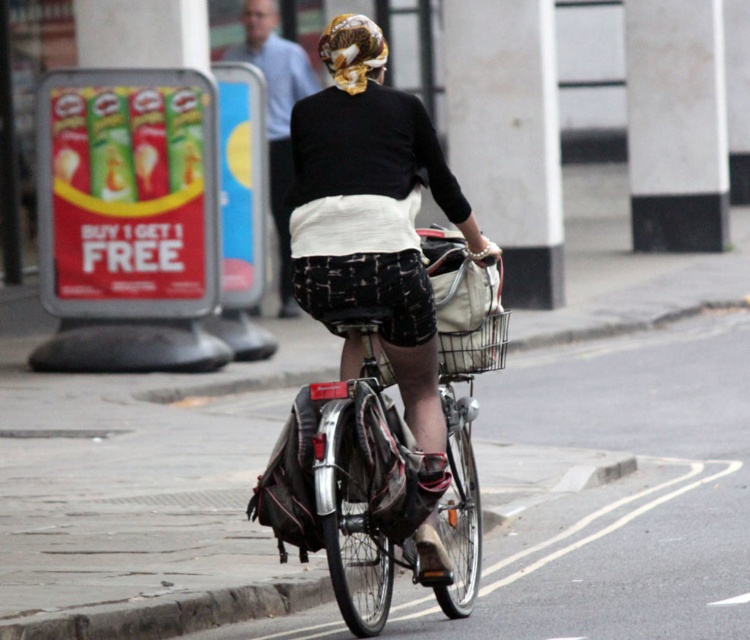
Question: Which is farther from the metallic silver basket at center?

Choices:
 (A) gold-patterned fabric helmet at upper center
 (B) matte black shorts at center

Answer: (A)

Question: Can you confirm if matte black shorts at center is positioned to the left of gold-patterned fabric helmet at upper center?

Choices:
 (A) no
 (B) yes

Answer: (A)

Question: Is matte black shorts at center smaller than metallic silver basket at center?

Choices:
 (A) yes
 (B) no

Answer: (B)

Question: Which point is farther to the camera?

Choices:
 (A) metallic silver basket at center
 (B) gold-patterned fabric helmet at upper center

Answer: (A)

Question: Which object appears closest to the camera in this image?

Choices:
 (A) metallic silver basket at center
 (B) matte black shorts at center
 (C) gold-patterned fabric helmet at upper center

Answer: (B)

Question: Is gold-patterned fabric helmet at upper center positioned in front of metallic silver basket at center?

Choices:
 (A) yes
 (B) no

Answer: (A)